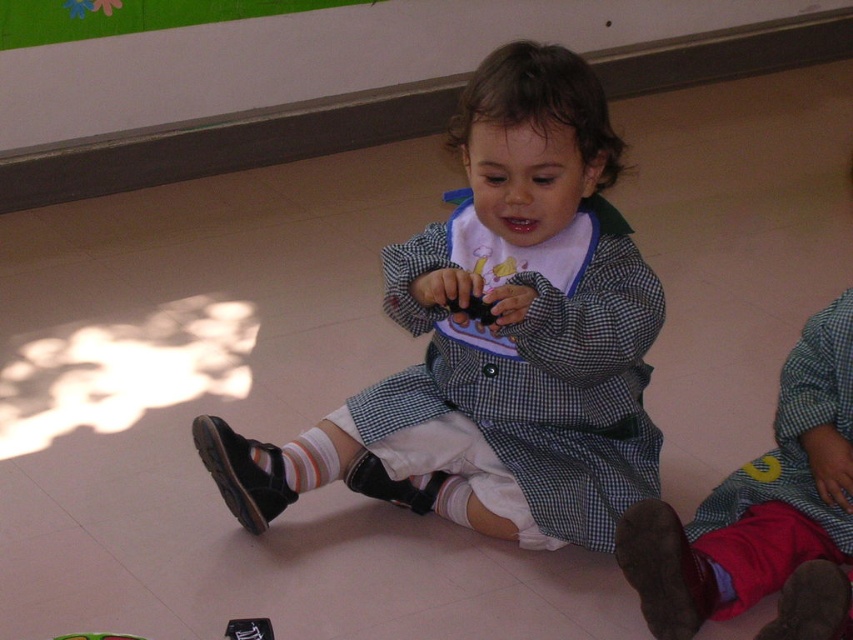
Can you confirm if checkered fabric coat at center is positioned to the left of red velvet pants at lower right?

Indeed, checkered fabric coat at center is positioned on the left side of red velvet pants at lower right.

Is checkered fabric coat at center smaller than red velvet pants at lower right?

Incorrect, checkered fabric coat at center is not smaller in size than red velvet pants at lower right.

Locate an element on the screen. checkered fabric coat at center is located at coordinates pyautogui.click(x=498, y=337).